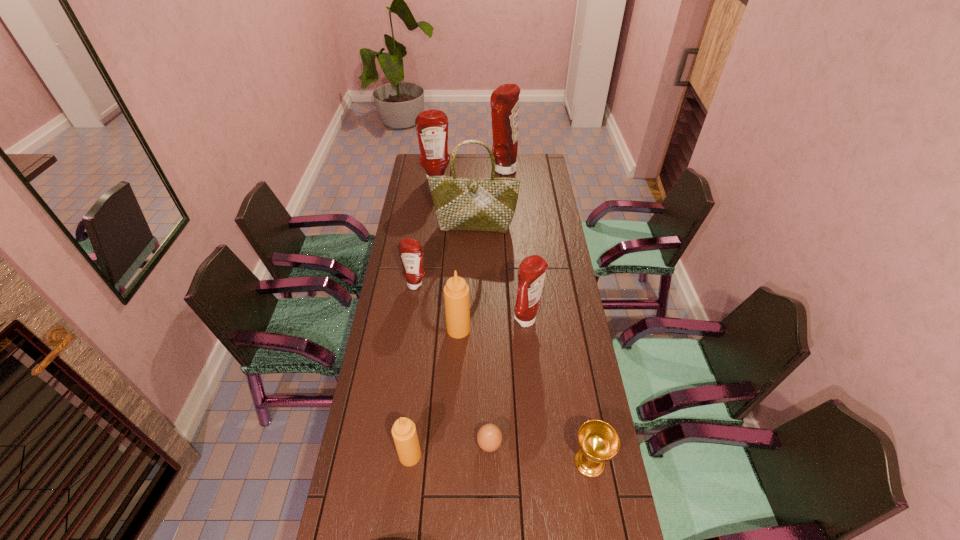
Locate an element on the screen. free space located on the front of the nearest red condiment is located at coordinates (534, 392).

You are a GUI agent. You are given a task and a screenshot of the screen. Output one action in this format:
    pyautogui.click(x=<x>, y=<y>)
    Task: Click on the vacant point located on the front of the sixth nearest object
    This screenshot has height=540, width=960.
    Given the screenshot: What is the action you would take?
    pyautogui.click(x=411, y=313)

At what (x,y) coordinates should I click in order to perform the action: click on vacant region located 0.290m on the right of the smaller tan condiment. Please return your answer as a coordinate pair (x, y). The image size is (960, 540). Looking at the image, I should click on (519, 455).

At what (x,y) coordinates should I click in order to perform the action: click on free location located on the left of the rightmost object. Please return your answer as a coordinate pair (x, y). The image size is (960, 540). Looking at the image, I should click on (447, 462).

I want to click on free region located 0.120m on the front of the shortest object, so click(491, 500).

Locate an element on the screen. shopping bag that is positioned at the left edge is located at coordinates (461, 204).

The image size is (960, 540). What are the coordinates of `condiment at the right edge` in the screenshot? It's located at (532, 270).

Locate an element on the screen. This screenshot has height=540, width=960. chalice at the right edge is located at coordinates (598, 441).

The image size is (960, 540). What are the coordinates of `object that is at the far left corner` in the screenshot? It's located at (432, 125).

The image size is (960, 540). In the image, there is a desktop. Find the location of `free space at the far edge`. free space at the far edge is located at coordinates (480, 177).